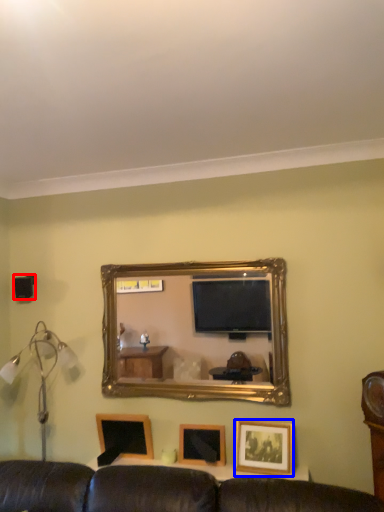
Question: Among these objects, which one is nearest to the camera, speaker (highlighted by a red box) or picture frame (highlighted by a blue box)?

Choices:
 (A) speaker
 (B) picture frame

Answer: (B)